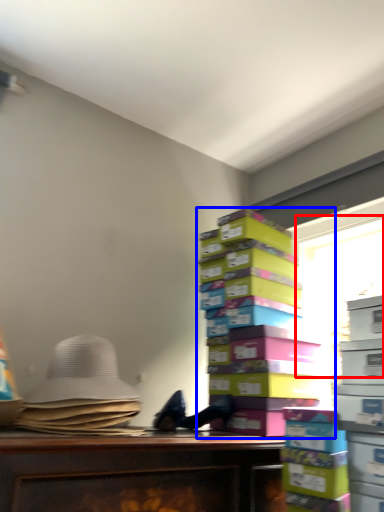
Question: Which object appears farthest to the camera in this image, window screen (highlighted by a red box) or book (highlighted by a blue box)?

Choices:
 (A) window screen
 (B) book

Answer: (A)